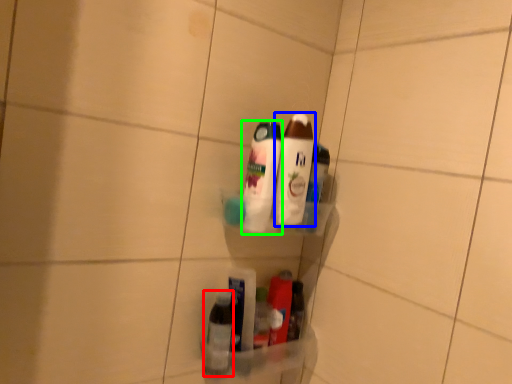
Question: Considering the real-world distances, which object is closest to bottle (highlighted by a red box)? bottle (highlighted by a blue box) or bottle (highlighted by a green box).

Choices:
 (A) bottle
 (B) bottle

Answer: (B)